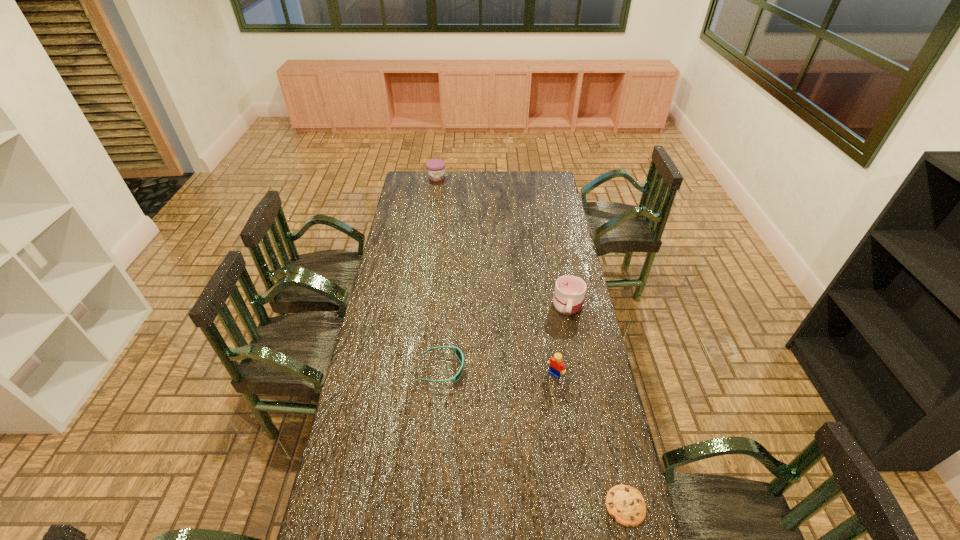
Where is `free location that satisfies the following two spatial constraints: 1. on the front side of the jam; 2. on the right side of the Lego`? This screenshot has width=960, height=540. free location that satisfies the following two spatial constraints: 1. on the front side of the jam; 2. on the right side of the Lego is located at coordinates (409, 374).

In order to click on vacant space that satisfies the following two spatial constraints: 1. on the front side of the third object from right to left; 2. on the right side of the jam in this screenshot , I will do `click(409, 374)`.